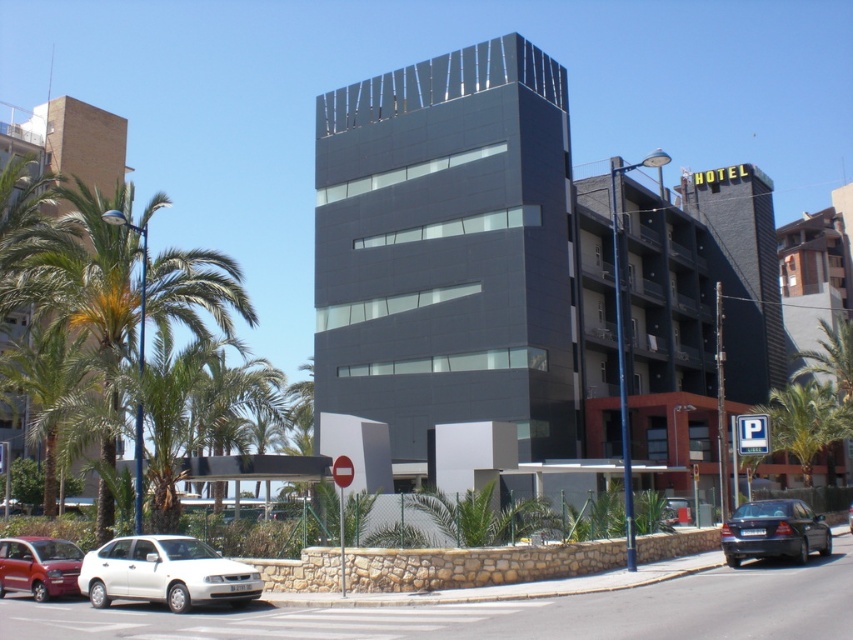
You are a pedestrian standing at the entrance of the building. You see a shiny black sedan at lower right and a green leafy palm tree at lower right. Which object is closer to your right side?

The shiny black sedan at lower right is to the left of green leafy palm tree at lower right, so the palm tree is closer to your right side.

You are standing in front of the building and see two points marked on the ground. The first point is at coordinate point [817,532] and the second is at point [4,545]. Which point is closer to your current position?

Point [4,545] is closer to your current position because it is nearer to the camera than point [817,532].